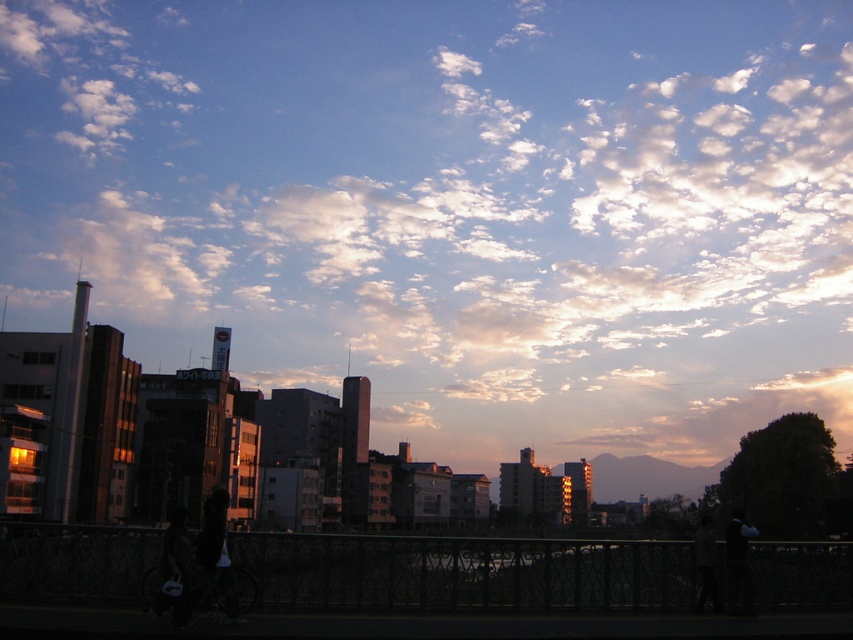
Question: Which point is closer to the camera?

Choices:
 (A) dark fabric jacket at lower left
 (B) dark fabric pants at lower left
 (C) white fluffy cloud at upper center

Answer: (A)

Question: Does dark fabric pants at lower left have a greater width compared to dark gray jacket at lower right?

Choices:
 (A) yes
 (B) no

Answer: (B)

Question: Can you confirm if dark blue fabric jacket at lower right is thinner than dark gray jacket at lower right?

Choices:
 (A) yes
 (B) no

Answer: (A)

Question: Estimate the real-world distances between objects in this image. Which object is closer to the dark fabric jacket at lower left?

Choices:
 (A) dark blue fabric jacket at lower right
 (B) dark fabric pants at lower left
 (C) dark gray jacket at lower right
 (D) white fluffy cloud at upper center

Answer: (B)

Question: Is white fluffy cloud at upper center positioned in front of dark gray jacket at lower right?

Choices:
 (A) yes
 (B) no

Answer: (B)

Question: Which point appears farthest from the camera in this image?

Choices:
 (A) (194, 298)
 (B) (219, 557)
 (C) (165, 561)

Answer: (A)